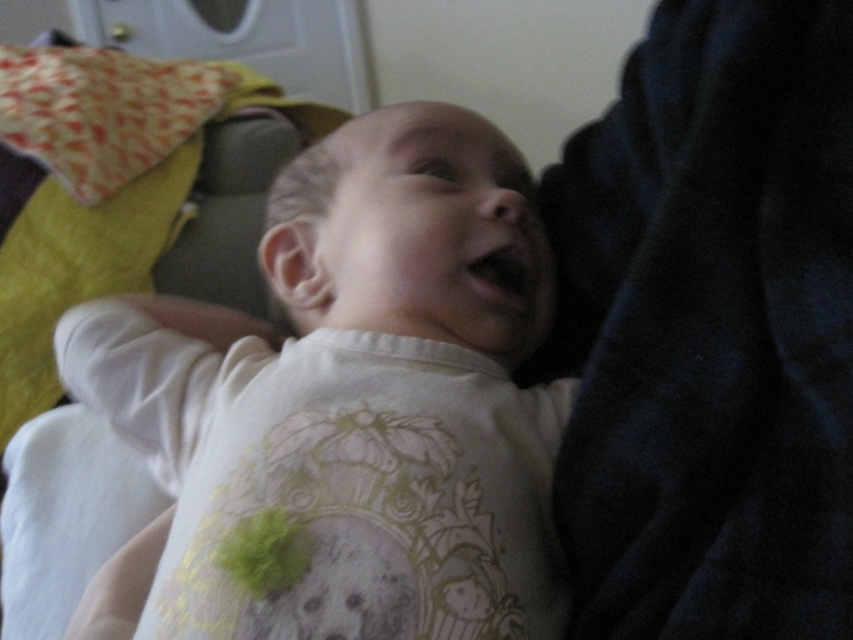
Is white soft baby at center to the left of printed fabric pillow at upper left from the viewer's perspective?

Incorrect, white soft baby at center is not on the left side of printed fabric pillow at upper left.

Between white soft baby at center and printed fabric pillow at upper left, which one is positioned lower?

white soft baby at center is lower down.

Where is `white soft baby at center`? white soft baby at center is located at coordinates pyautogui.click(x=349, y=403).

This screenshot has height=640, width=853. I want to click on white soft baby at center, so click(349, 403).